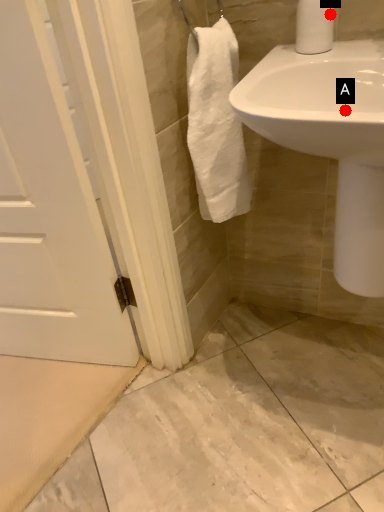
Question: Two points are circled on the image, labeled by A and B beside each circle. Among these points, which one is nearest to the camera?

Choices:
 (A) A is closer
 (B) B is closer

Answer: (A)